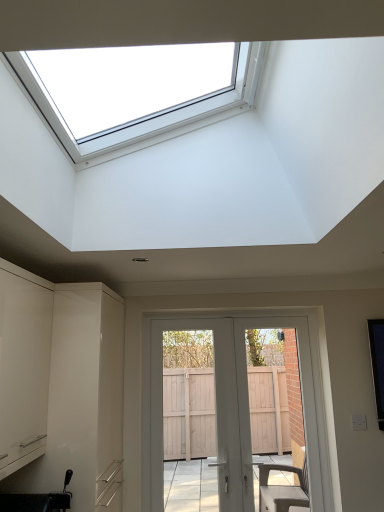
Question: Can you confirm if white glossy door at center is smaller than black plastic sink at lower left?

Choices:
 (A) yes
 (B) no

Answer: (B)

Question: Can you confirm if white glossy door at center is bigger than black plastic sink at lower left?

Choices:
 (A) no
 (B) yes

Answer: (B)

Question: Is the depth of white glossy door at center greater than that of black plastic sink at lower left?

Choices:
 (A) yes
 (B) no

Answer: (A)

Question: Is white glossy door at center not close to black plastic sink at lower left?

Choices:
 (A) yes
 (B) no

Answer: (A)

Question: Is white glossy door at center at the left side of black plastic sink at lower left?

Choices:
 (A) yes
 (B) no

Answer: (B)

Question: Would you say white glossy door at center is inside or outside white matte cabinet at left, the second cabinetry viewed from the back?

Choices:
 (A) inside
 (B) outside

Answer: (B)

Question: Is point (213, 381) positioned closer to the camera than point (41, 391)?

Choices:
 (A) closer
 (B) farther

Answer: (B)

Question: From a real-world perspective, is white glossy door at center physically located above or below white matte cabinet at left, which is the 1th cabinetry from front to back?

Choices:
 (A) below
 (B) above

Answer: (A)

Question: From the image's perspective, is white glossy door at center located above or below white matte cabinet at left, the second cabinetry viewed from the back?

Choices:
 (A) below
 (B) above

Answer: (A)

Question: Considering the positions of black plastic sink at lower left and white glossy cabinet at left, the second cabinetry in the front-to-back sequence, in the image, is black plastic sink at lower left wider or thinner than white glossy cabinet at left, the second cabinetry in the front-to-back sequence,?

Choices:
 (A) wide
 (B) thin

Answer: (B)

Question: Relative to white glossy cabinet at left, the second cabinetry in the front-to-back sequence, is black plastic sink at lower left in front or behind?

Choices:
 (A) behind
 (B) front

Answer: (B)

Question: Which is correct: black plastic sink at lower left is inside white glossy cabinet at left, placed as the 1th cabinetry when sorted from back to front, or outside of it?

Choices:
 (A) outside
 (B) inside

Answer: (A)

Question: In terms of size, does black plastic sink at lower left appear bigger or smaller than white glossy cabinet at left, the second cabinetry in the front-to-back sequence?

Choices:
 (A) big
 (B) small

Answer: (B)

Question: Is point (3, 311) positioned closer to the camera than point (34, 499)?

Choices:
 (A) farther
 (B) closer

Answer: (B)

Question: In terms of width, does white glossy cabinet at left, placed as the 1th cabinetry when sorted from back to front, look wider or thinner when compared to black plastic sink at lower left?

Choices:
 (A) thin
 (B) wide

Answer: (B)